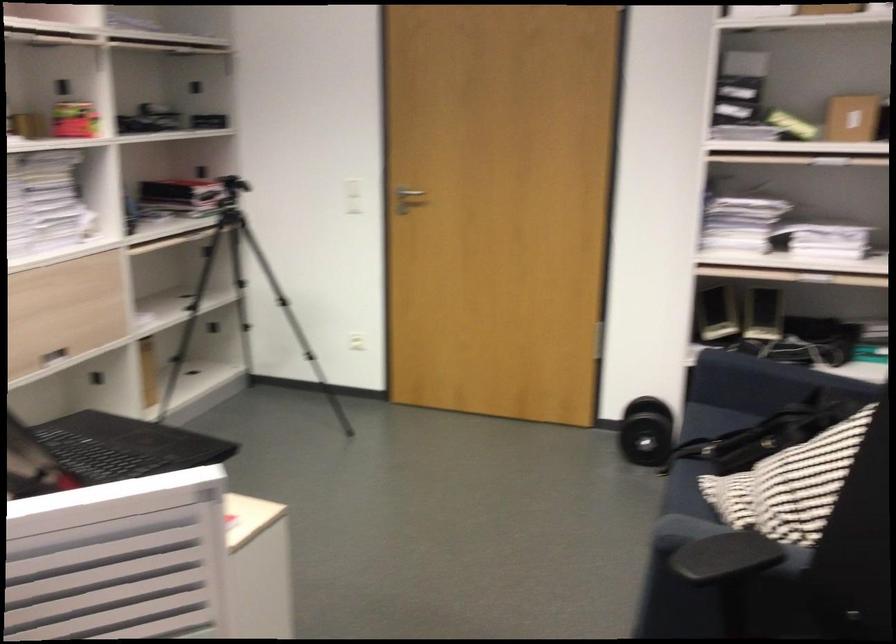
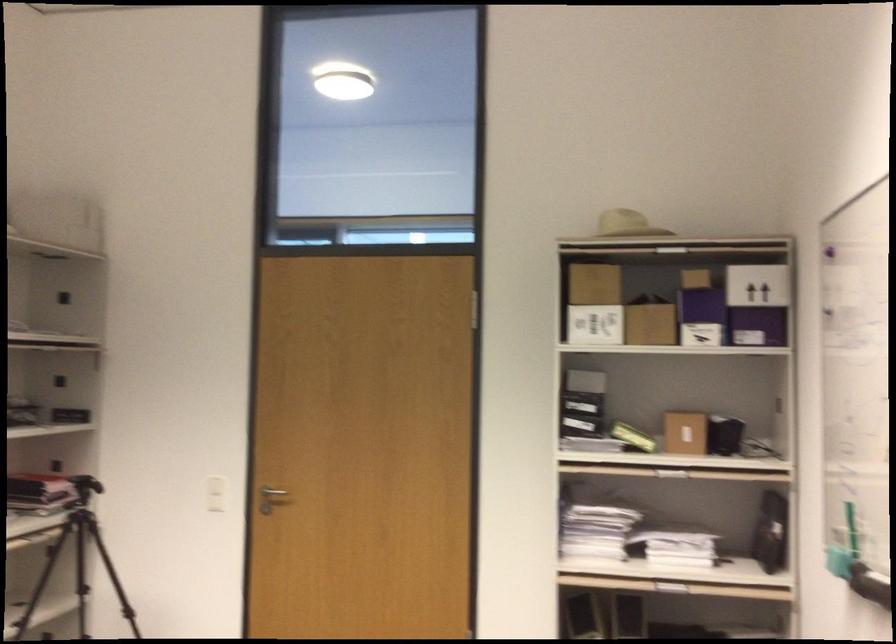
Question: The first image is from the beginning of the video and the second image is from the end. How did the camera likely rotate when shooting the video?

Choices:
 (A) Left
 (B) Right
 (C) Up
 (D) Down

Answer: (C)